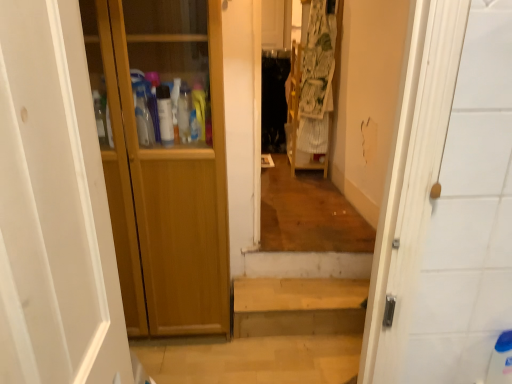
Question: Is wooden cabinet at left inside wooden cabinet at left?

Choices:
 (A) yes
 (B) no

Answer: (B)

Question: Considering the relative sizes of wooden cabinet at left and wooden cabinet at left in the image provided, is wooden cabinet at left taller than wooden cabinet at left?

Choices:
 (A) yes
 (B) no

Answer: (A)

Question: From the image's perspective, is wooden cabinet at left above wooden cabinet at left?

Choices:
 (A) no
 (B) yes

Answer: (B)

Question: Is wooden cabinet at left at the back of wooden cabinet at left?

Choices:
 (A) no
 (B) yes

Answer: (A)

Question: Are wooden cabinet at left and wooden cabinet at left far apart?

Choices:
 (A) no
 (B) yes

Answer: (A)

Question: From a real-world perspective, is wooden cabinet at left beneath wooden cabinet at left?

Choices:
 (A) yes
 (B) no

Answer: (B)

Question: Is there a large distance between printed fabric laundry at center and wooden cabinet at left?

Choices:
 (A) no
 (B) yes

Answer: (B)

Question: Is printed fabric laundry at center shorter than wooden cabinet at left?

Choices:
 (A) yes
 (B) no

Answer: (B)

Question: Can we say printed fabric laundry at center lies outside wooden cabinet at left?

Choices:
 (A) no
 (B) yes

Answer: (B)

Question: Considering the relative positions of printed fabric laundry at center and wooden cabinet at left in the image provided, is printed fabric laundry at center to the left of wooden cabinet at left from the viewer's perspective?

Choices:
 (A) no
 (B) yes

Answer: (A)

Question: Considering the relative sizes of printed fabric laundry at center and wooden cabinet at left in the image provided, is printed fabric laundry at center taller than wooden cabinet at left?

Choices:
 (A) yes
 (B) no

Answer: (A)

Question: From the image's perspective, is printed fabric laundry at center below wooden cabinet at left?

Choices:
 (A) no
 (B) yes

Answer: (A)

Question: Does wooden stairs at center lie behind wooden cabinet at left?

Choices:
 (A) yes
 (B) no

Answer: (A)